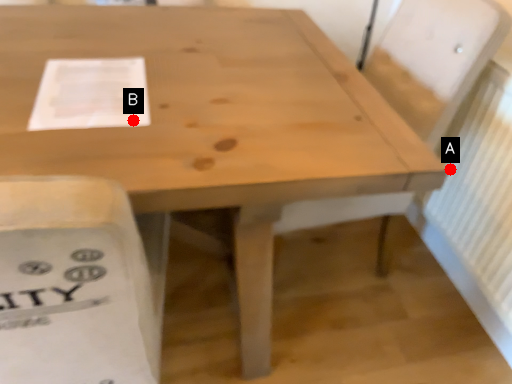
Question: Two points are circled on the image, labeled by A and B beside each circle. Which of the following is the closest to the observer?

Choices:
 (A) A is closer
 (B) B is closer

Answer: (B)